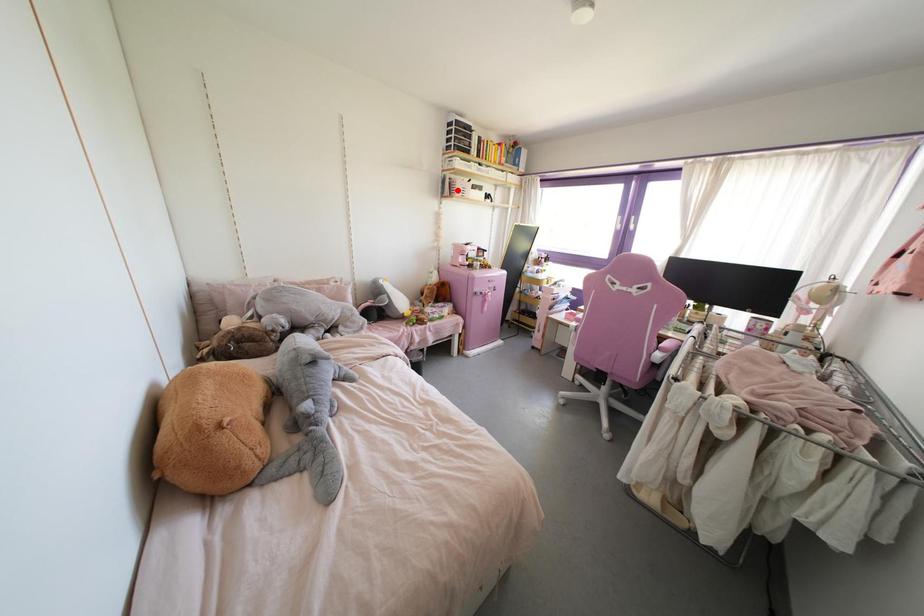
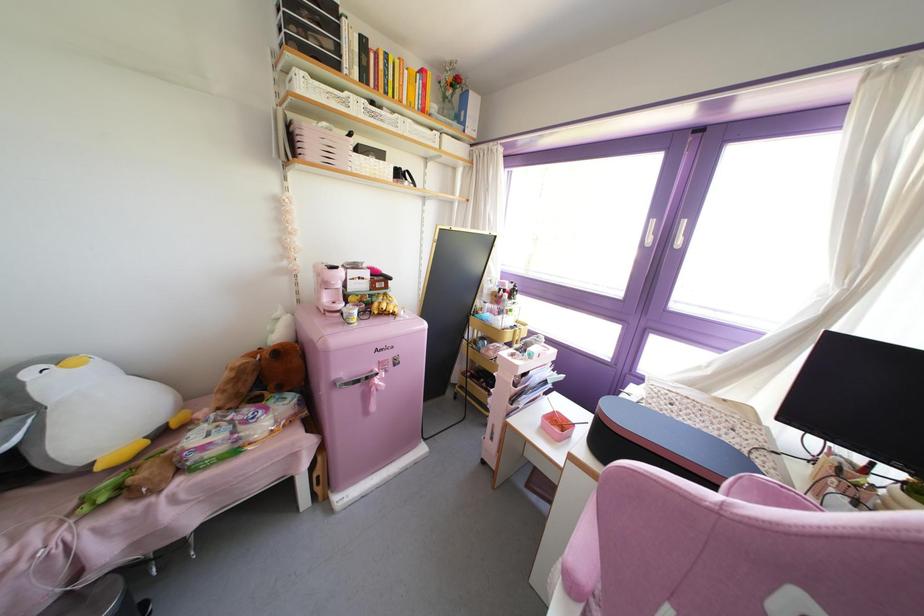
Question: I am providing you with two images of the same scene from different viewpoints. Image1 has a red point marked. In image2, the corresponding 3D location appears at what relative position? Reply with the corresponding letter.

Choices:
 (A) Closer
 (B) Farther

Answer: (B)